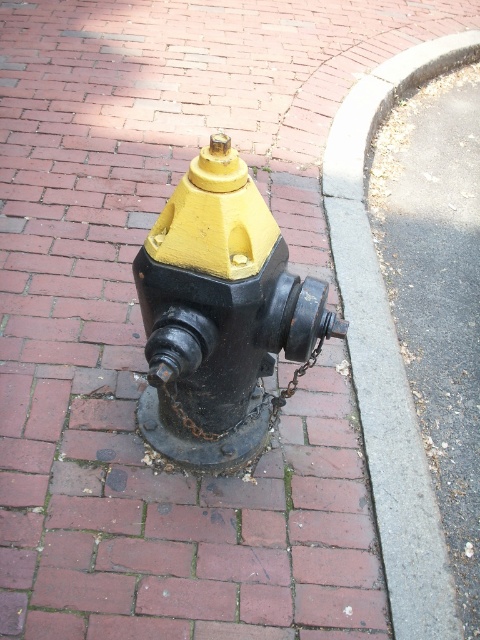
Which is more to the right, gray concrete curb at lower right or rusty metal chain at center?

Positioned to the right is gray concrete curb at lower right.

Consider the image. Does gray concrete curb at lower right come in front of rusty metal chain at center?

No.

Describe the element at coordinates (388, 349) in the screenshot. The height and width of the screenshot is (640, 480). I see `gray concrete curb at lower right` at that location.

This screenshot has height=640, width=480. I want to click on gray concrete curb at lower right, so coord(388,349).

Based on the photo, is matte black fire hydrant at center closer to camera compared to rusty metal chain at center?

Yes, matte black fire hydrant at center is closer to the viewer.

Is point (192, 316) closer to viewer compared to point (233, 428)?

Yes.

Which is in front, point (216, 308) or point (205, 435)?

Positioned in front is point (216, 308).

At what (x,y) coordinates should I click in order to perform the action: click on matte black fire hydrant at center. Please return your answer as a coordinate pair (x, y). The height and width of the screenshot is (640, 480). Looking at the image, I should click on (x=218, y=314).

Is matte black fire hydrant at center below gray concrete curb at lower right?

Indeed, matte black fire hydrant at center is positioned under gray concrete curb at lower right.

Who is higher up, matte black fire hydrant at center or gray concrete curb at lower right?

Positioned higher is gray concrete curb at lower right.

Find the location of a particular element. Image resolution: width=480 pixels, height=640 pixels. matte black fire hydrant at center is located at coordinates (218, 314).